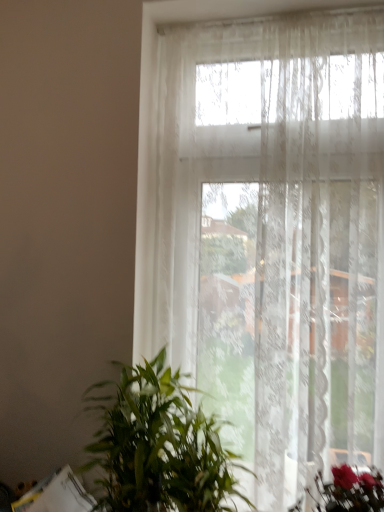
Measure the distance between green leafy plant at lower left and camera.

They are 1.04 meters apart.

Describe the element at coordinates (157, 445) in the screenshot. I see `green leafy plant at lower left` at that location.

Measure the distance between point (220,442) and camera.

They are 1.29 meters apart.

Locate an element on the screen. green leafy plant at lower left is located at coordinates (157, 445).

Describe the element at coordinates (268, 234) in the screenshot. I see `transparent lace curtain at upper center` at that location.

In order to face transparent lace curtain at upper center, should I rotate leftwards or rightwards?

You should rotate right by 9.208 degrees.

At what (x,y) coordinates should I click in order to perform the action: click on transparent lace curtain at upper center. Please return your answer as a coordinate pair (x, y). The height and width of the screenshot is (512, 384). Looking at the image, I should click on (268, 234).

Where is `green leafy plant at lower left`? The image size is (384, 512). green leafy plant at lower left is located at coordinates (157, 445).

In the image, is green leafy plant at lower left on the left side or the right side of transparent lace curtain at upper center?

green leafy plant at lower left is to the left of transparent lace curtain at upper center.

Does green leafy plant at lower left lie behind transparent lace curtain at upper center?

No, green leafy plant at lower left is closer to the viewer.

Is point (142, 402) positioned after point (157, 231)?

No, (142, 402) is closer to viewer.

From the image's perspective, is green leafy plant at lower left located above or below transparent lace curtain at upper center?

Clearly, from the image's perspective, green leafy plant at lower left is below transparent lace curtain at upper center.

From a real-world perspective, relative to transparent lace curtain at upper center, is green leafy plant at lower left vertically above or below?

From a real-world perspective, green leafy plant at lower left is physically below transparent lace curtain at upper center.

Based on the photo, considering the relative sizes of green leafy plant at lower left and transparent lace curtain at upper center in the image provided, is green leafy plant at lower left thinner than transparent lace curtain at upper center?

No, green leafy plant at lower left is not thinner than transparent lace curtain at upper center.

From their relative heights in the image, would you say green leafy plant at lower left is taller or shorter than transparent lace curtain at upper center?

Clearly, green leafy plant at lower left is shorter compared to transparent lace curtain at upper center.

Between green leafy plant at lower left and transparent lace curtain at upper center, which one has larger size?

transparent lace curtain at upper center.

Is green leafy plant at lower left not within transparent lace curtain at upper center?

Yes, green leafy plant at lower left is outside of transparent lace curtain at upper center.

Is green leafy plant at lower left far from transparent lace curtain at upper center?

They are positioned close to each other.

Is green leafy plant at lower left oriented towards transparent lace curtain at upper center?

No, green leafy plant at lower left is not oriented towards transparent lace curtain at upper center.

How different are the orientations of green leafy plant at lower left and transparent lace curtain at upper center in degrees?

The angular difference between green leafy plant at lower left and transparent lace curtain at upper center is 1.32 degrees.

How much distance is there between green leafy plant at lower left and transparent lace curtain at upper center?

green leafy plant at lower left and transparent lace curtain at upper center are 14.23 inches apart from each other.

I want to click on window that appears above the green leafy plant at lower left (from the image's perspective), so click(x=268, y=234).

Which is more to the left, transparent lace curtain at upper center or green leafy plant at lower left?

From the viewer's perspective, green leafy plant at lower left appears more on the left side.

Is transparent lace curtain at upper center further to camera compared to green leafy plant at lower left?

Yes, transparent lace curtain at upper center is behind green leafy plant at lower left.

Is point (353, 259) farther from viewer compared to point (218, 474)?

Yes, it is.

From the image's perspective, which is above, transparent lace curtain at upper center or green leafy plant at lower left?

transparent lace curtain at upper center appears higher in the image.

From a real-world perspective, who is located higher, transparent lace curtain at upper center or green leafy plant at lower left?

In real-world perspective, transparent lace curtain at upper center is above.

Can you confirm if transparent lace curtain at upper center is thinner than green leafy plant at lower left?

Yes, transparent lace curtain at upper center is thinner than green leafy plant at lower left.

Considering the sizes of objects transparent lace curtain at upper center and green leafy plant at lower left in the image provided, who is shorter, transparent lace curtain at upper center or green leafy plant at lower left?

green leafy plant at lower left is shorter.

Based on the photo, looking at the image, does transparent lace curtain at upper center seem bigger or smaller compared to green leafy plant at lower left?

In the image, transparent lace curtain at upper center appears to be larger than green leafy plant at lower left.

Does transparent lace curtain at upper center contain green leafy plant at lower left?

That's incorrect, green leafy plant at lower left is not inside transparent lace curtain at upper center.

Is transparent lace curtain at upper center not close to green leafy plant at lower left?

transparent lace curtain at upper center is actually quite close to green leafy plant at lower left.

Is green leafy plant at lower left at the back of transparent lace curtain at upper center?

Yes.

How distant is transparent lace curtain at upper center from green leafy plant at lower left?

transparent lace curtain at upper center and green leafy plant at lower left are 14.23 inches apart from each other.

I want to click on window above the green leafy plant at lower left (from the image's perspective), so click(268, 234).

You are a GUI agent. You are given a task and a screenshot of the screen. Output one action in this format:
    pyautogui.click(x=<x>, y=<y>)
    Task: Click on the houseplant that is on the left side of transparent lace curtain at upper center
    
    Given the screenshot: What is the action you would take?
    pyautogui.click(x=157, y=445)

At what (x,y) coordinates should I click in order to perform the action: click on houseplant below the transparent lace curtain at upper center (from the image's perspective). Please return your answer as a coordinate pair (x, y). Looking at the image, I should click on (157, 445).